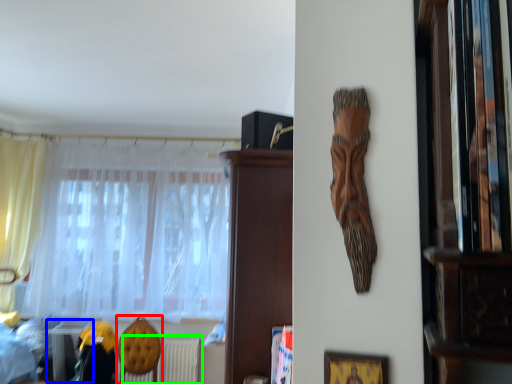
Question: Which object is the closest to the armchair (highlighted by a red box)? Choose among these: table (highlighted by a blue box) or radiator (highlighted by a green box).

Choices:
 (A) table
 (B) radiator

Answer: (B)